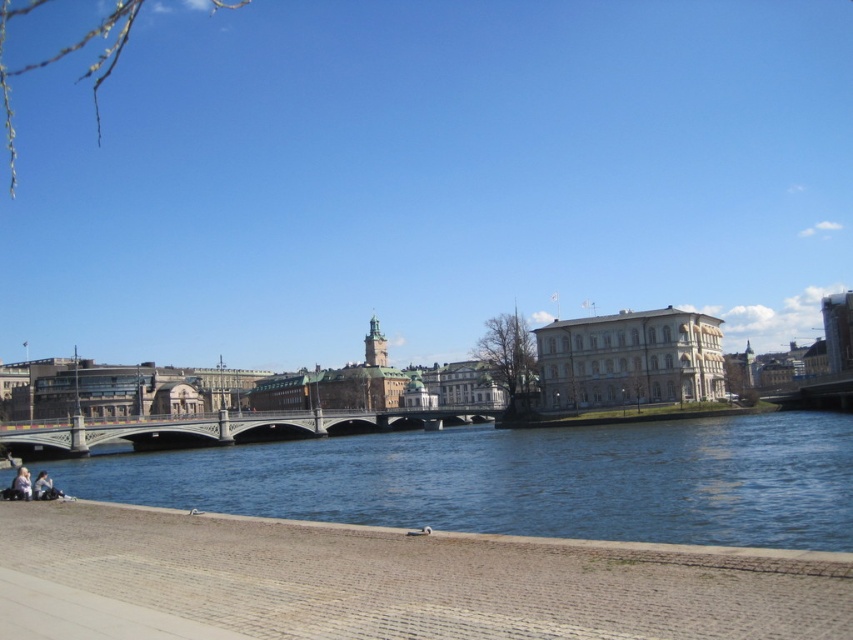
You are standing on the paved walkway and want to cross the river to reach the classical building on the right. The white stone bridge at center and the light blue denim jeans at lower left are in your path. Which object should you avoid stepping on to safely cross the river?

You should avoid stepping on the light blue denim jeans at lower left because the white stone bridge at center is located below it, meaning the bridge is the safe path while the jeans are positioned above and might be an obstacle.

You are standing on the paved walkway and want to take a photo of the blue water at lower center and the light blue denim jeans at lower left. Which object should you point your camera towards first if you want to capture both in a single frame without moving the camera?

You should point your camera towards the light blue denim jeans at lower left first because the blue water at lower center is below it, meaning the jeans are higher up and can be captured in the same frame by adjusting the angle slightly.